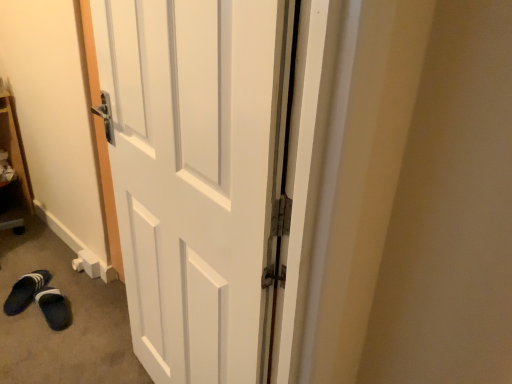
Measure the distance between point (139, 244) and camera.

Point (139, 244) and camera are 1.33 meters apart from each other.

The height and width of the screenshot is (384, 512). Describe the element at coordinates (197, 176) in the screenshot. I see `white matte door at center` at that location.

Image resolution: width=512 pixels, height=384 pixels. What are the coordinates of `black fabric slipper at lower left, arranged as the 2th footwear when viewed from the right` in the screenshot? It's located at (25, 291).

Image resolution: width=512 pixels, height=384 pixels. In order to click on dark blue fabric slippers at lower left, the second footwear viewed from the left in this screenshot , I will do `click(54, 308)`.

Who is smaller, black fabric slipper at lower left, placed as the 1th footwear when sorted from left to right, or white matte door at center?

Smaller between the two is black fabric slipper at lower left, placed as the 1th footwear when sorted from left to right.

Identify the location of the 1st footwear directly beneath the white matte door at center (from a real-world perspective). Image resolution: width=512 pixels, height=384 pixels. (25, 291).

In terms of width, does black fabric slipper at lower left, arranged as the 2th footwear when viewed from the right, look wider or thinner when compared to white matte door at center?

In the image, black fabric slipper at lower left, arranged as the 2th footwear when viewed from the right, appears to be wider than white matte door at center.

From the image's perspective, is dark blue fabric slippers at lower left, the first footwear in the right-to-left sequence, over black fabric slipper at lower left, arranged as the 2th footwear when viewed from the right?

No.

Which of these two, dark blue fabric slippers at lower left, the first footwear in the right-to-left sequence, or black fabric slipper at lower left, arranged as the 2th footwear when viewed from the right, is smaller?

Smaller between the two is dark blue fabric slippers at lower left, the first footwear in the right-to-left sequence.

Is the position of dark blue fabric slippers at lower left, the second footwear viewed from the left, more distant than that of black fabric slipper at lower left, arranged as the 2th footwear when viewed from the right?

No, dark blue fabric slippers at lower left, the second footwear viewed from the left, is closer to the viewer.

You are a GUI agent. You are given a task and a screenshot of the screen. Output one action in this format:
    pyautogui.click(x=<x>, y=<y>)
    Task: Click on the door above the dark blue fabric slippers at lower left, the first footwear in the right-to-left sequence (from the image's perspective)
    
    Given the screenshot: What is the action you would take?
    pyautogui.click(x=197, y=176)

Considering the relative positions of dark blue fabric slippers at lower left, the first footwear in the right-to-left sequence, and white matte door at center in the image provided, is dark blue fabric slippers at lower left, the first footwear in the right-to-left sequence, to the left or to the right of white matte door at center?

In the image, dark blue fabric slippers at lower left, the first footwear in the right-to-left sequence, appears on the left side of white matte door at center.

Is dark blue fabric slippers at lower left, the second footwear viewed from the left, further to the viewer compared to white matte door at center?

Yes.

Considering the relative sizes of white matte door at center and dark blue fabric slippers at lower left, the first footwear in the right-to-left sequence, in the image provided, is white matte door at center thinner than dark blue fabric slippers at lower left, the first footwear in the right-to-left sequence,?

Yes, white matte door at center is thinner than dark blue fabric slippers at lower left, the first footwear in the right-to-left sequence.

Which of these two, white matte door at center or dark blue fabric slippers at lower left, the first footwear in the right-to-left sequence, stands shorter?

dark blue fabric slippers at lower left, the first footwear in the right-to-left sequence.

From a real-world perspective, which is physically above, white matte door at center or dark blue fabric slippers at lower left, the first footwear in the right-to-left sequence?

In real-world perspective, white matte door at center is above.

Is white matte door at center looking in the opposite direction of dark blue fabric slippers at lower left, the second footwear viewed from the left?

white matte door at center does not have its back to dark blue fabric slippers at lower left, the second footwear viewed from the left.

From a real-world perspective, between black fabric slipper at lower left, arranged as the 2th footwear when viewed from the right, and dark blue fabric slippers at lower left, the second footwear viewed from the left, who is vertically lower?

In real-world perspective, dark blue fabric slippers at lower left, the second footwear viewed from the left, is lower.

In the image, is black fabric slipper at lower left, arranged as the 2th footwear when viewed from the right, on the left side or the right side of dark blue fabric slippers at lower left, the first footwear in the right-to-left sequence?

black fabric slipper at lower left, arranged as the 2th footwear when viewed from the right, is positioned on dark blue fabric slippers at lower left, the first footwear in the right-to-left sequence,'s left side.

From the image's perspective, which one is positioned higher, black fabric slipper at lower left, placed as the 1th footwear when sorted from left to right, or dark blue fabric slippers at lower left, the first footwear in the right-to-left sequence?

black fabric slipper at lower left, placed as the 1th footwear when sorted from left to right, appears higher in the image.

How many degrees apart are the facing directions of white matte door at center and black fabric slipper at lower left, arranged as the 2th footwear when viewed from the right?

The facing directions of white matte door at center and black fabric slipper at lower left, arranged as the 2th footwear when viewed from the right, are 44 degrees apart.

Identify the location of door above the black fabric slipper at lower left, placed as the 1th footwear when sorted from left to right (from a real-world perspective). The width and height of the screenshot is (512, 384). (197, 176).

Is white matte door at center spatially inside black fabric slipper at lower left, arranged as the 2th footwear when viewed from the right, or outside of it?

white matte door at center is not inside black fabric slipper at lower left, arranged as the 2th footwear when viewed from the right, it's outside.

Find the location of a particular element. This screenshot has height=384, width=512. door in front of the black fabric slipper at lower left, placed as the 1th footwear when sorted from left to right is located at coordinates (197, 176).

In order to click on footwear that is on the left side of dark blue fabric slippers at lower left, the second footwear viewed from the left in this screenshot , I will do `click(25, 291)`.

From the image, which object appears to be farther from white matte door at center, black fabric slipper at lower left, arranged as the 2th footwear when viewed from the right, or dark blue fabric slippers at lower left, the first footwear in the right-to-left sequence?

black fabric slipper at lower left, arranged as the 2th footwear when viewed from the right.

Estimate the real-world distances between objects in this image. Which object is further from white matte door at center, dark blue fabric slippers at lower left, the first footwear in the right-to-left sequence, or black fabric slipper at lower left, placed as the 1th footwear when sorted from left to right?

black fabric slipper at lower left, placed as the 1th footwear when sorted from left to right.

Estimate the real-world distances between objects in this image. Which object is further from dark blue fabric slippers at lower left, the first footwear in the right-to-left sequence, black fabric slipper at lower left, arranged as the 2th footwear when viewed from the right, or white matte door at center?

white matte door at center is further to dark blue fabric slippers at lower left, the first footwear in the right-to-left sequence.

Looking at this image, looking at the image, which one is located further to dark blue fabric slippers at lower left, the second footwear viewed from the left, white matte door at center or black fabric slipper at lower left, placed as the 1th footwear when sorted from left to right?

white matte door at center lies further to dark blue fabric slippers at lower left, the second footwear viewed from the left, than the other object.

Based on the photo, estimate the real-world distances between objects in this image. Which object is closer to black fabric slipper at lower left, placed as the 1th footwear when sorted from left to right, dark blue fabric slippers at lower left, the first footwear in the right-to-left sequence, or white matte door at center?

dark blue fabric slippers at lower left, the first footwear in the right-to-left sequence, is closer to black fabric slipper at lower left, placed as the 1th footwear when sorted from left to right.

Considering their positions, is white matte door at center positioned further to black fabric slipper at lower left, arranged as the 2th footwear when viewed from the right, than dark blue fabric slippers at lower left, the second footwear viewed from the left?

Among the two, white matte door at center is located further to black fabric slipper at lower left, arranged as the 2th footwear when viewed from the right.

You are a GUI agent. You are given a task and a screenshot of the screen. Output one action in this format:
    pyautogui.click(x=<x>, y=<y>)
    Task: Click on the footwear between white matte door at center and black fabric slipper at lower left, arranged as the 2th footwear when viewed from the right, along the z-axis
    
    Given the screenshot: What is the action you would take?
    pyautogui.click(x=54, y=308)